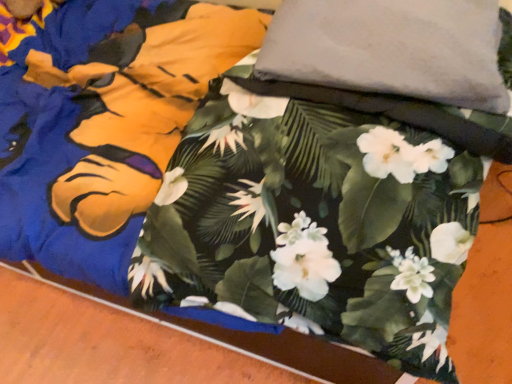
Question: Should I look upward or downward to see gray fabric pillow at upper center?

Choices:
 (A) up
 (B) down

Answer: (A)